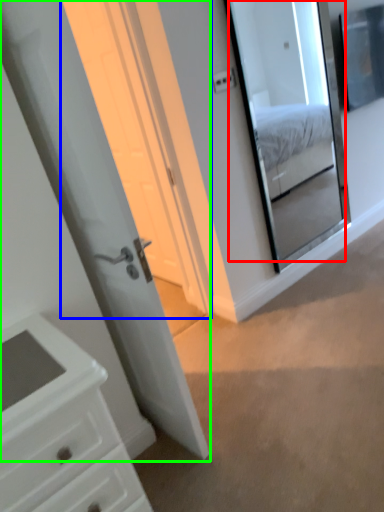
Question: Which is nearer to the mirror (highlighted by a red box)? screen door (highlighted by a blue box) or door (highlighted by a green box).

Choices:
 (A) screen door
 (B) door

Answer: (A)